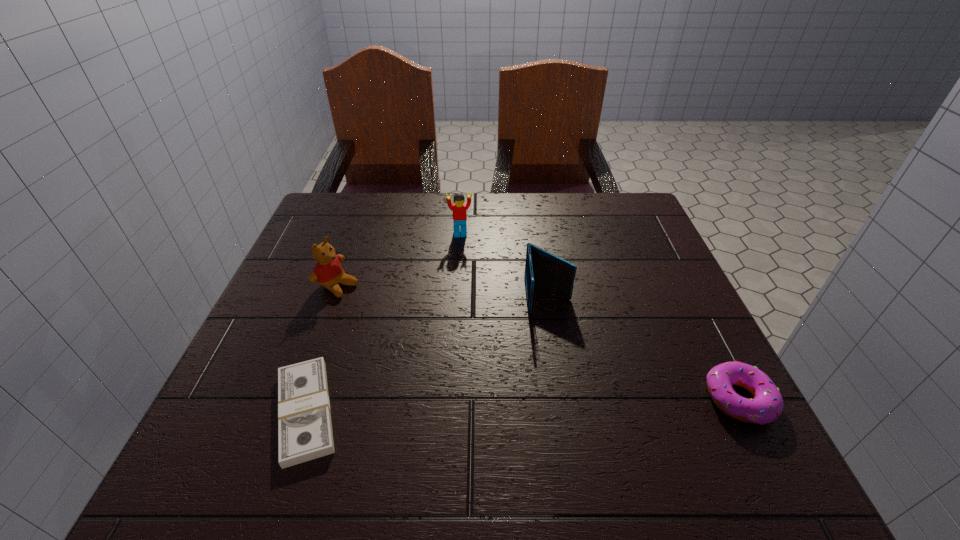
At what (x,y) coordinates should I click in order to perform the action: click on free space on the desktop that is between the shortest object and the fourth tallest object and is positioned on the face of the Lego. Please return your answer as a coordinate pair (x, y). Looking at the image, I should click on (492, 406).

At what (x,y) coordinates should I click in order to perform the action: click on free space on the desktop that is between the dollar and the rightmost object and is positioned on the front-facing side of the teddy bear. Please return your answer as a coordinate pair (x, y). Looking at the image, I should click on (583, 403).

You are a GUI agent. You are given a task and a screenshot of the screen. Output one action in this format:
    pyautogui.click(x=<x>, y=<y>)
    Task: Click on the vacant space on the desktop that is between the shortest object and the second shortest object and is positioned on the exterior surface of the third shortest object
    The height and width of the screenshot is (540, 960).
    Given the screenshot: What is the action you would take?
    pyautogui.click(x=564, y=404)